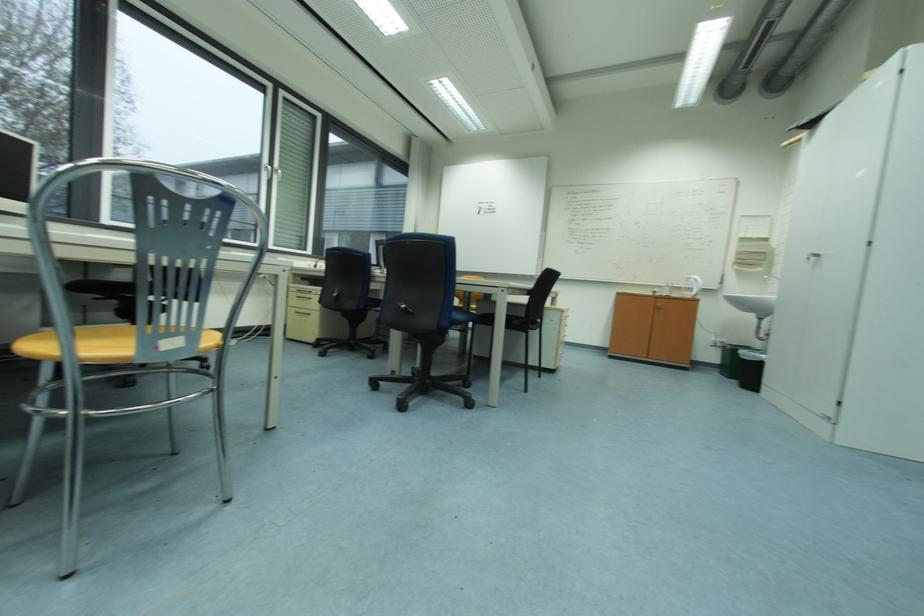
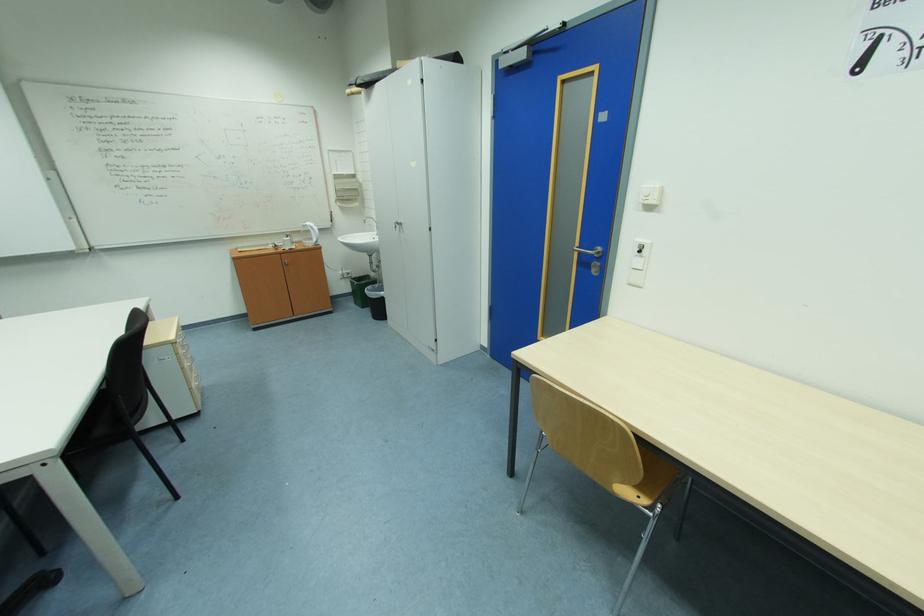
In the second image, find the point that corresponds to the point at 732,376 in the first image.

(362, 304)